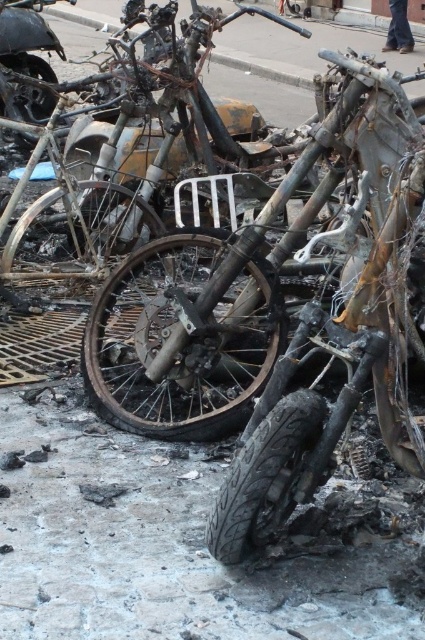
Question: Can you confirm if charcoal rubber tire at lower center is thinner than charred metal motorcycle at upper left?

Choices:
 (A) yes
 (B) no

Answer: (A)

Question: Estimate the real-world distances between objects in this image. Which object is closer to the charcoal rubber tire at lower center?

Choices:
 (A) charcoal rubber tire at center-left
 (B) charcoal matte bicycle at center

Answer: (B)

Question: Can you confirm if charcoal rubber tire at center is bigger than charcoal rubber tire at lower center?

Choices:
 (A) yes
 (B) no

Answer: (A)

Question: Does charcoal rubber tire at lower center appear under charcoal rubber tire at center-left?

Choices:
 (A) yes
 (B) no

Answer: (A)

Question: Which object is positioned farthest from the charcoal matte bicycle at center?

Choices:
 (A) charcoal rubber tire at center
 (B) charred metal motorcycle at upper left

Answer: (B)

Question: Which of the following is the closest to the observer?

Choices:
 (A) (34, 93)
 (B) (22, 26)

Answer: (B)